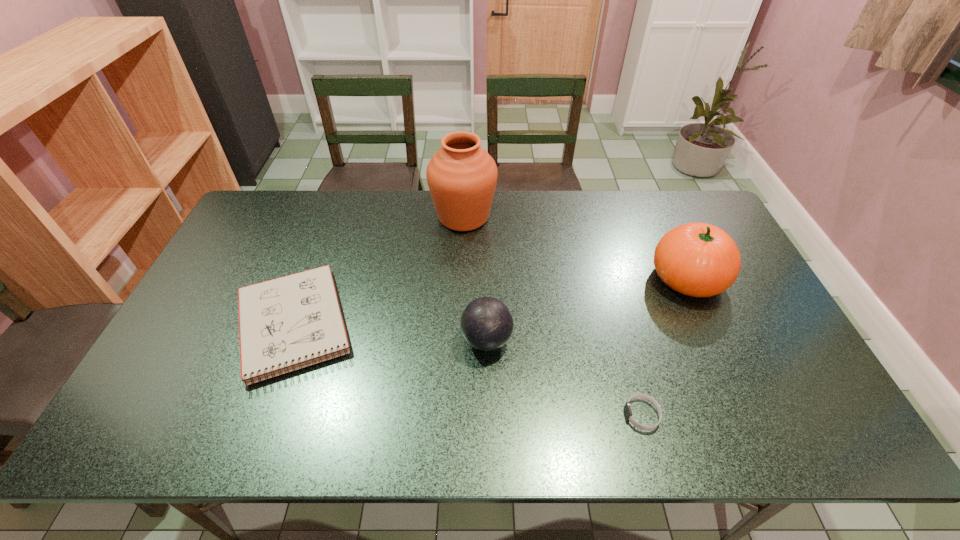
This screenshot has width=960, height=540. What are the coordinates of `vacant region located 0.060m on the left of the pumpkin` in the screenshot? It's located at (630, 278).

At what (x,y) coordinates should I click in order to perform the action: click on blank area located 0.280m on the grip area of the bowling ball. Please return your answer as a coordinate pair (x, y). The height and width of the screenshot is (540, 960). Looking at the image, I should click on (355, 340).

At what (x,y) coordinates should I click in order to perform the action: click on vacant space situated 0.270m on the grip area of the bowling ball. Please return your answer as a coordinate pair (x, y). This screenshot has height=540, width=960. Looking at the image, I should click on (359, 340).

Find the location of `free region located 0.210m on the grip area of the bowling ball`. free region located 0.210m on the grip area of the bowling ball is located at coordinates (381, 340).

This screenshot has width=960, height=540. I want to click on vacant space located on the left of the notepad, so click(185, 325).

You are a GUI agent. You are given a task and a screenshot of the screen. Output one action in this format:
    pyautogui.click(x=<x>, y=<y>)
    Task: Click on the vacant space positioned on the outer surface of the nearest object
    This screenshot has width=960, height=540.
    Given the screenshot: What is the action you would take?
    pyautogui.click(x=560, y=415)

Identify the location of vacant space located 0.380m on the outer surface of the nearest object. This screenshot has height=540, width=960. pos(461,415).

At what (x,y) coordinates should I click in order to perform the action: click on vacant space located 0.390m on the outer surface of the nearest object. Please return your answer as a coordinate pair (x, y). Image resolution: width=960 pixels, height=540 pixels. Looking at the image, I should click on (456, 415).

The image size is (960, 540). I want to click on object present at the far edge, so click(462, 176).

At what (x,y) coordinates should I click in order to perform the action: click on object situated at the near edge. Please return your answer as a coordinate pair (x, y). This screenshot has height=540, width=960. Looking at the image, I should click on [627, 409].